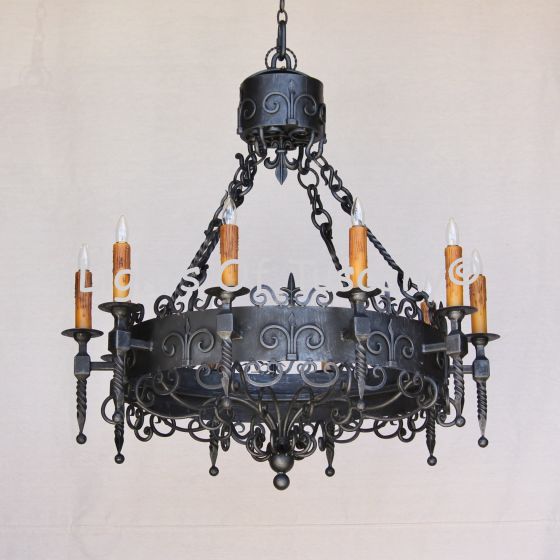
What are the coordinates of `wall` in the screenshot? It's located at (84, 45), (70, 500), (501, 508), (504, 56).